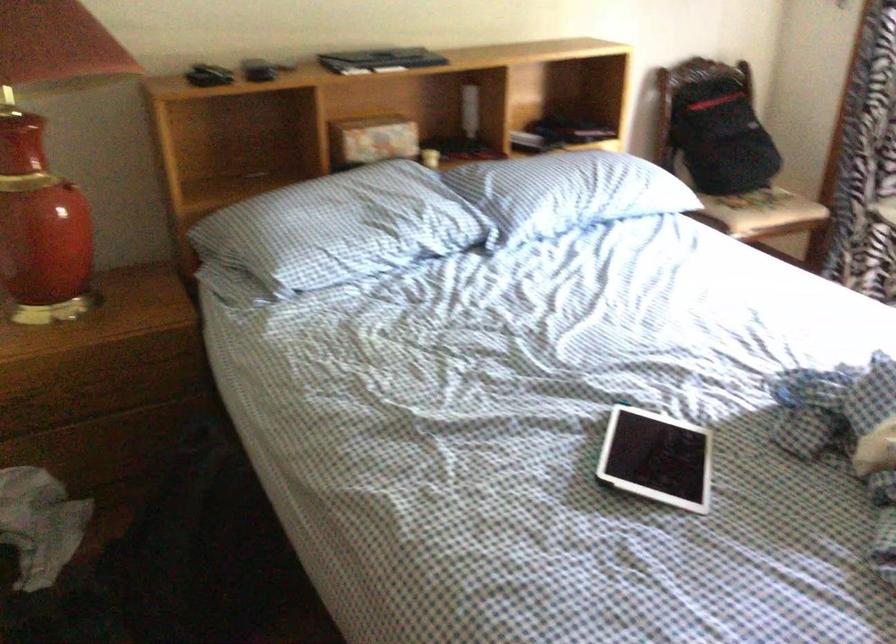
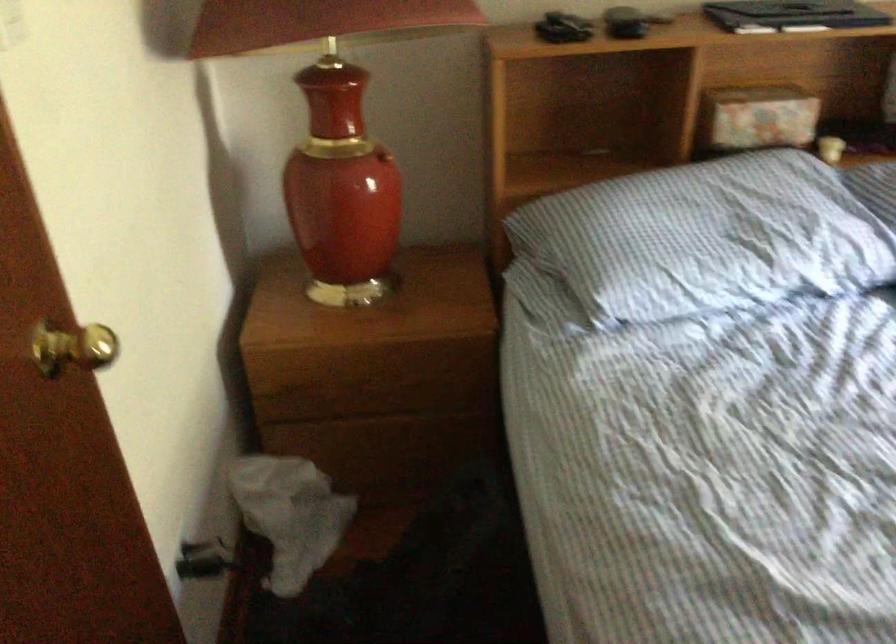
In the second image, find the point that corresponds to (375,140) in the first image.

(757, 118)